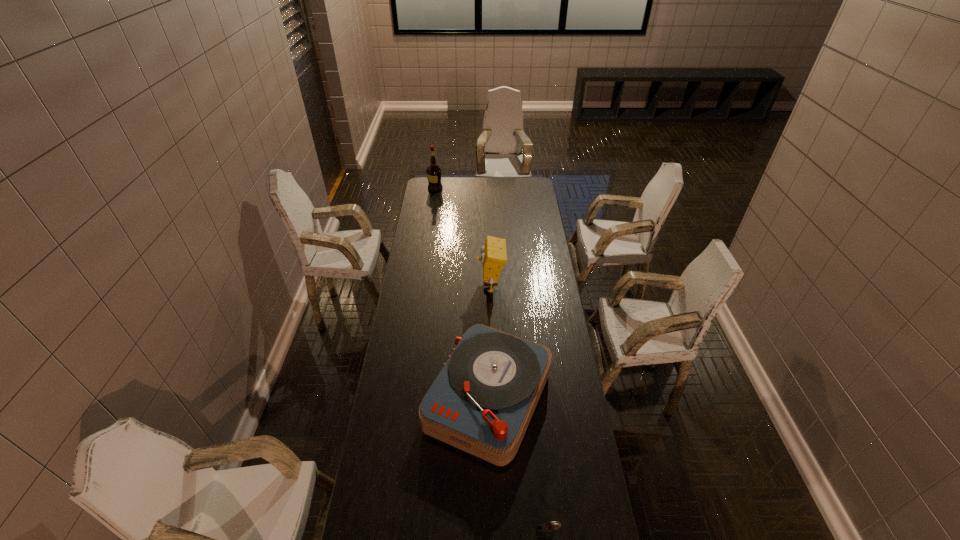
This screenshot has width=960, height=540. I want to click on blank space at the right edge of the desktop, so click(x=564, y=319).

Where is `vacant point at the far left corner`? The image size is (960, 540). vacant point at the far left corner is located at coordinates (433, 194).

Find the location of a particular element. The width and height of the screenshot is (960, 540). vacant area that lies between the farthest object and the third nearest object is located at coordinates (463, 237).

This screenshot has width=960, height=540. I want to click on free space between the second tallest object and the leftmost object, so click(463, 237).

Locate which object ranks in proximity to the leftmost object. Please provide its 2D coordinates. Your answer should be formatted as a tuple, i.e. [(x, y)], where the tuple contains the x and y coordinates of a point satisfying the conditions above.

[(493, 254)]

Identify the location of object that is the closest to the record player. This screenshot has height=540, width=960. (544, 530).

Where is `blank area in the image that satisfies the following two spatial constraints: 1. on the face of the third shortest object; 2. on the front side of the second shortest object`? This screenshot has width=960, height=540. blank area in the image that satisfies the following two spatial constraints: 1. on the face of the third shortest object; 2. on the front side of the second shortest object is located at coordinates (493, 398).

Where is `blank space that satisfies the following two spatial constraints: 1. on the label of the farthest object; 2. on the left side of the record player`? Image resolution: width=960 pixels, height=540 pixels. blank space that satisfies the following two spatial constraints: 1. on the label of the farthest object; 2. on the left side of the record player is located at coordinates (405, 398).